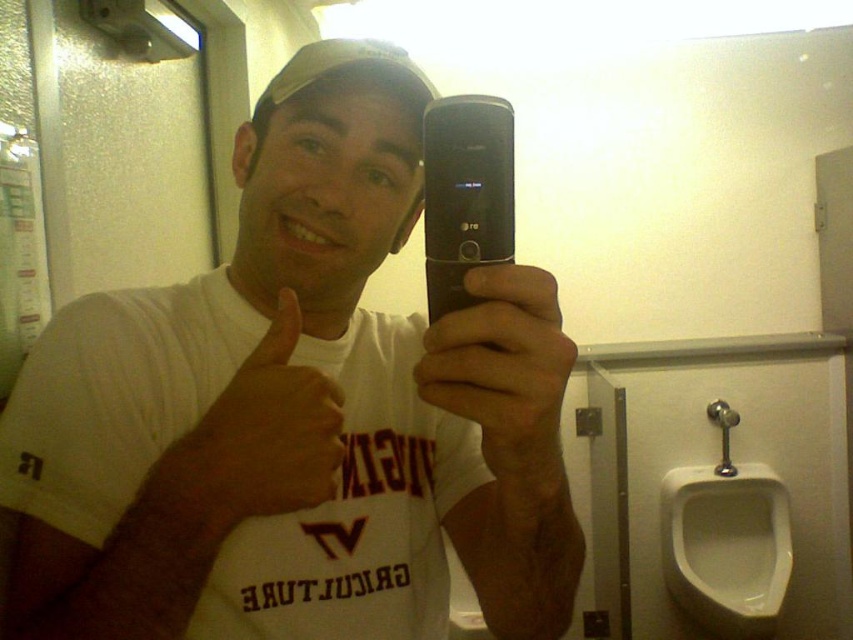
You are a photographer trying to capture the man taking a selfie in the restroom. You notice a skinny white hand at upper center located at point (x=256, y=440). Is this hand part of the man in the image?

The skinny white hand at upper center located at point (x=256, y=440) belongs to the man in the image, as it is part of his body.

You are a photographer trying to capture the scene in the image. You notice two elements in the frame that are important for the composition. The first is the skinny white hand at upper center, and the second is the matte black phone at center. Based on their positions, which of these two elements is located to the left side of the other?

The skinny white hand at upper center is positioned to the left of the matte black phone at center, so the hand is on the left side relative to the phone.

You are a photographer trying to capture the scene of the man taking a selfie in the restroom. Based on the positions of the white glossy urinal at lower right and the black plastic phone at center, which object is closer to you as the photographer?

The white glossy urinal at lower right is closer to you than the black plastic phone at center because it is further to the viewer.